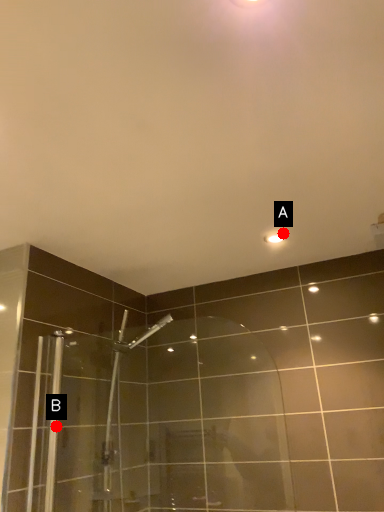
Question: Two points are circled on the image, labeled by A and B beside each circle. Which point is further to the camera?

Choices:
 (A) A is further
 (B) B is further

Answer: (A)